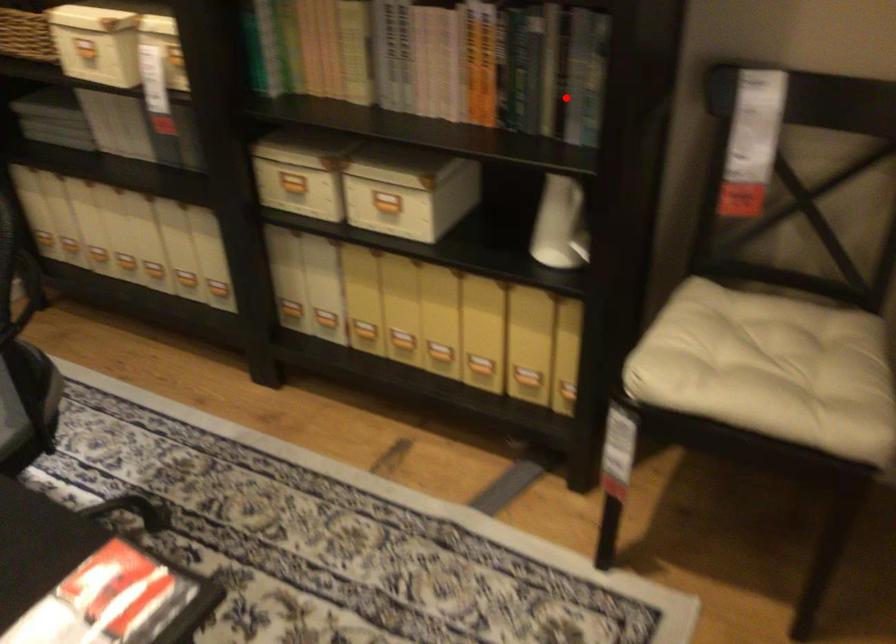
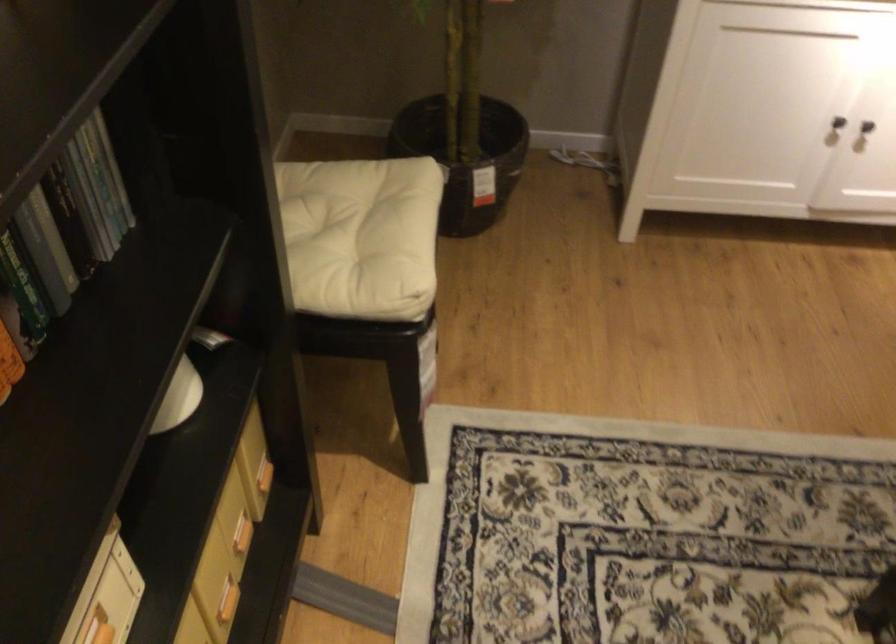
Locate, in the second image, the point that corresponds to the highlighted location in the first image.

(53, 238)